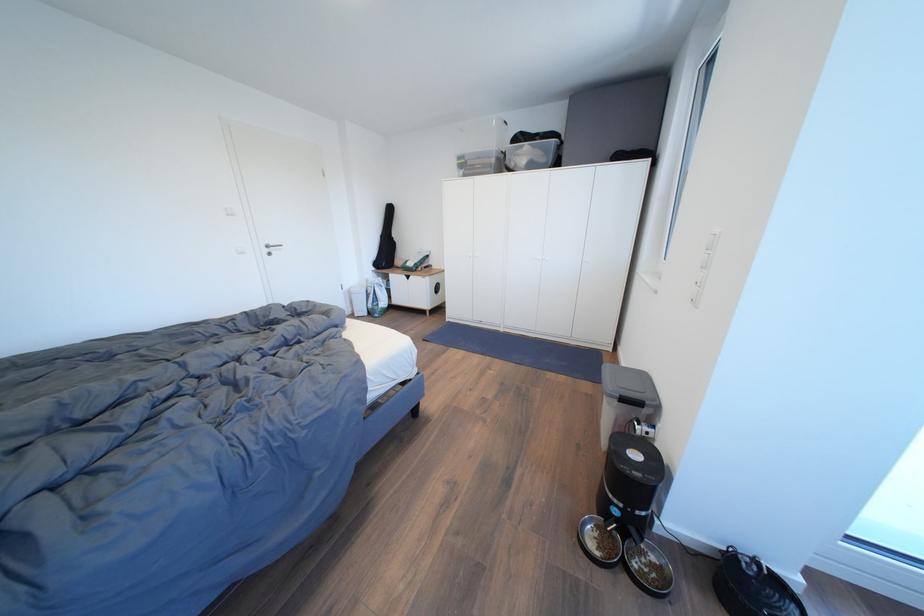
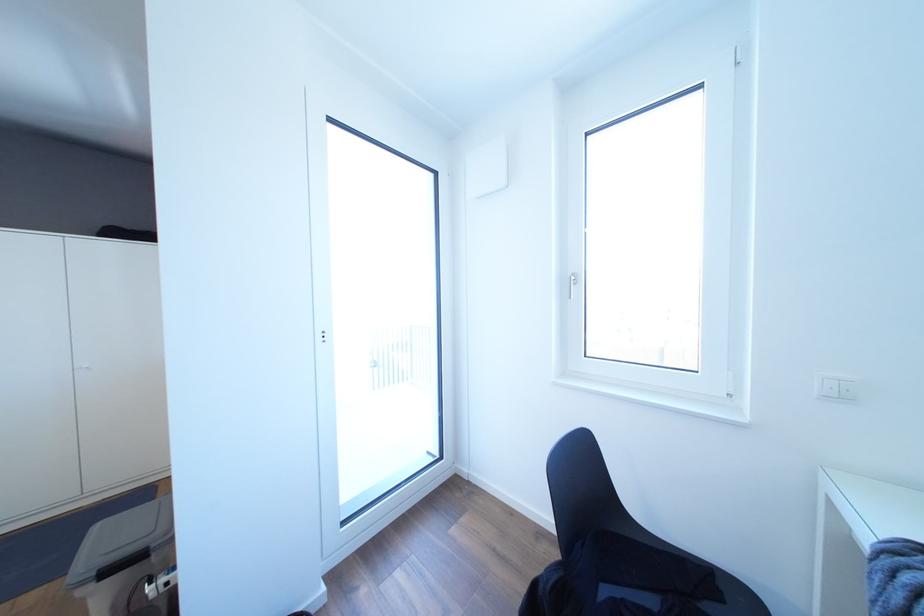
Question: The first image is from the beginning of the video and the second image is from the end. How did the camera likely rotate when shooting the video?

Choices:
 (A) Left
 (B) Right
 (C) Up
 (D) Down

Answer: (B)